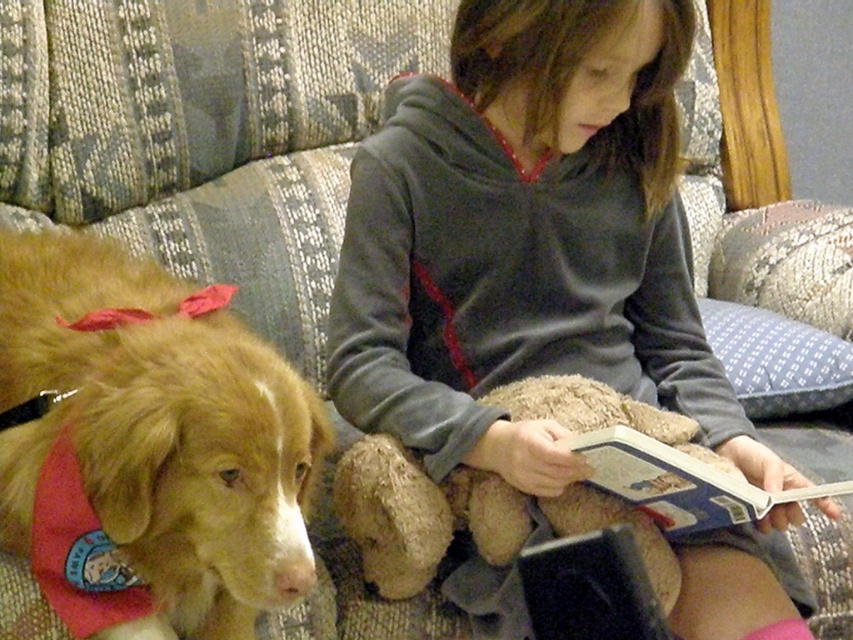
Between gray fleece hoodie at upper center and hardcover book at center, which one is positioned higher?

gray fleece hoodie at upper center

Where is `gray fleece hoodie at upper center`? gray fleece hoodie at upper center is located at coordinates (527, 243).

Identify the location of gray fleece hoodie at upper center. This screenshot has width=853, height=640. (527, 243).

Find the location of `gray fleece hoodie at upper center`. gray fleece hoodie at upper center is located at coordinates (527, 243).

Is gray fleece hoodie at upper center wider than golden fur dog at left?

Indeed, gray fleece hoodie at upper center has a greater width compared to golden fur dog at left.

In order to click on gray fleece hoodie at upper center in this screenshot , I will do `click(527, 243)`.

Where is `gray fleece hoodie at upper center`? This screenshot has width=853, height=640. gray fleece hoodie at upper center is located at coordinates (527, 243).

Is golden fur dog at left shorter than hardcover book at center?

Incorrect, golden fur dog at left's height does not fall short of hardcover book at center's.

Which of these two, golden fur dog at left or hardcover book at center, stands taller?

golden fur dog at left is taller.

Where is `golden fur dog at left`? This screenshot has width=853, height=640. golden fur dog at left is located at coordinates [x=148, y=445].